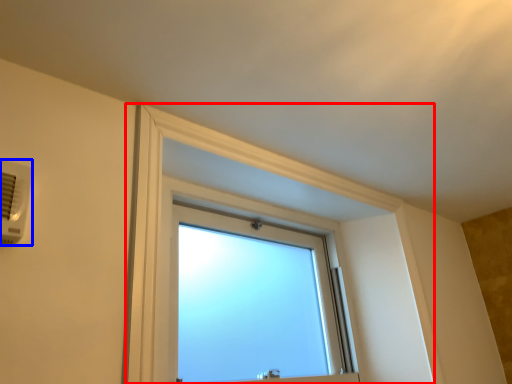
Question: Among these objects, which one is farthest to the camera, bay window (highlighted by a red box) or air conditioning (highlighted by a blue box)?

Choices:
 (A) bay window
 (B) air conditioning

Answer: (A)